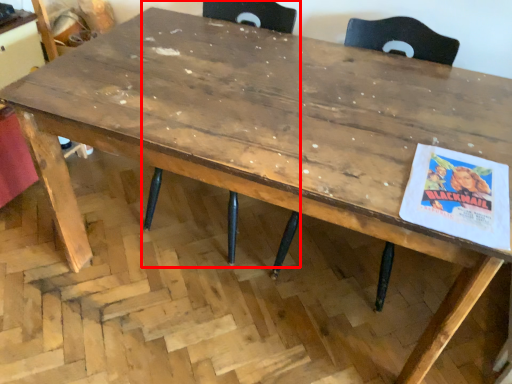
Question: From the image's perspective, where is chair (annotated by the red box) located relative to chair?

Choices:
 (A) above
 (B) below

Answer: (A)